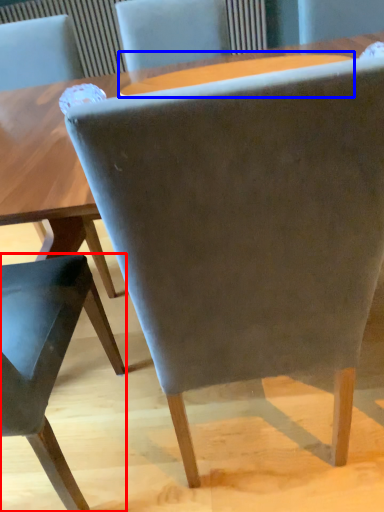
Question: Which of the following is the farthest to the observer, chair (highlighted by a red box) or round table (highlighted by a blue box)?

Choices:
 (A) chair
 (B) round table

Answer: (B)